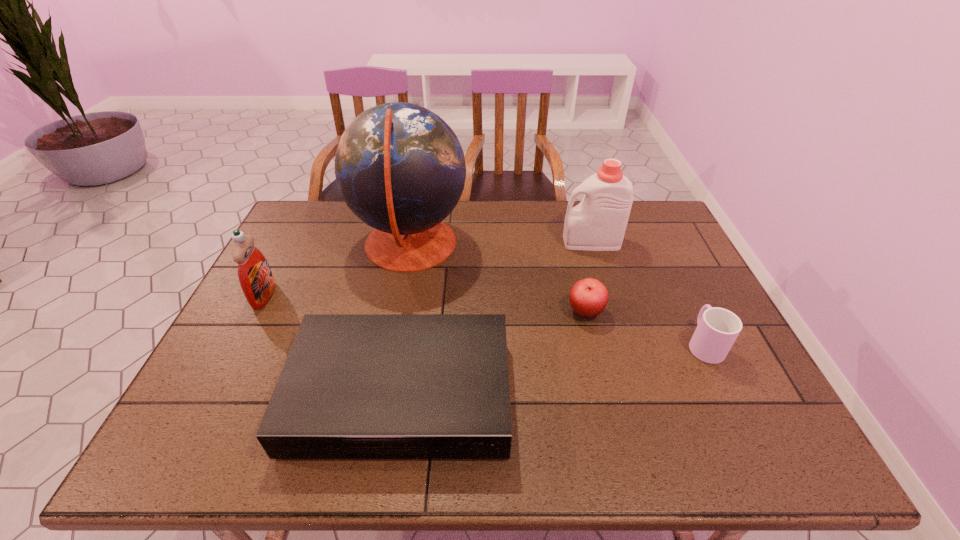
Image resolution: width=960 pixels, height=540 pixels. In order to click on vacant area between the cup and the globe in this screenshot , I will do `click(557, 295)`.

Locate an element on the screen. blank region between the CD player and the rightmost object is located at coordinates (552, 369).

At what (x,y) coordinates should I click in order to perform the action: click on free space that is in between the right detergent and the cup. Please return your answer as a coordinate pair (x, y). Image resolution: width=960 pixels, height=540 pixels. Looking at the image, I should click on (648, 293).

Locate an element on the screen. This screenshot has width=960, height=540. object identified as the fourth closest to the cup is located at coordinates (400, 168).

Select which object appears as the second closest to the apple. Please provide its 2D coordinates. Your answer should be formatted as a tuple, i.e. [(x, y)], where the tuple contains the x and y coordinates of a point satisfying the conditions above.

[(717, 329)]

I want to click on free space that satisfies the following two spatial constraints: 1. on the back side of the apple; 2. with the Americas facing the viewer on the tallest object, so click(x=569, y=246).

In order to click on vacant region that satisfies the following two spatial constraints: 1. on the front surface of the third tallest object; 2. on the right side of the apple in this screenshot , I will do `click(255, 312)`.

Locate an element on the screen. vacant position in the image that satisfies the following two spatial constraints: 1. with the handle on the side of the rightmost object; 2. on the front surface of the nearer detergent is located at coordinates (681, 295).

This screenshot has height=540, width=960. Identify the location of vacant space that satisfies the following two spatial constraints: 1. with the handle on the side of the cup; 2. on the front surface of the left detergent. (681, 295).

Locate an element on the screen. The height and width of the screenshot is (540, 960). vacant point that satisfies the following two spatial constraints: 1. with the handle on the side of the rightmost object; 2. with the Americas facing the viewer on the tallest object is located at coordinates (657, 246).